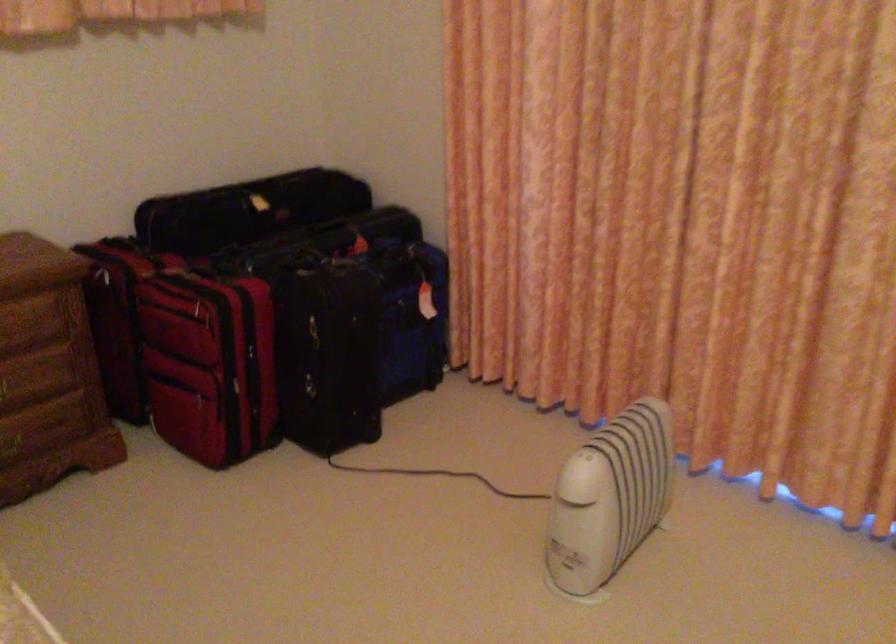
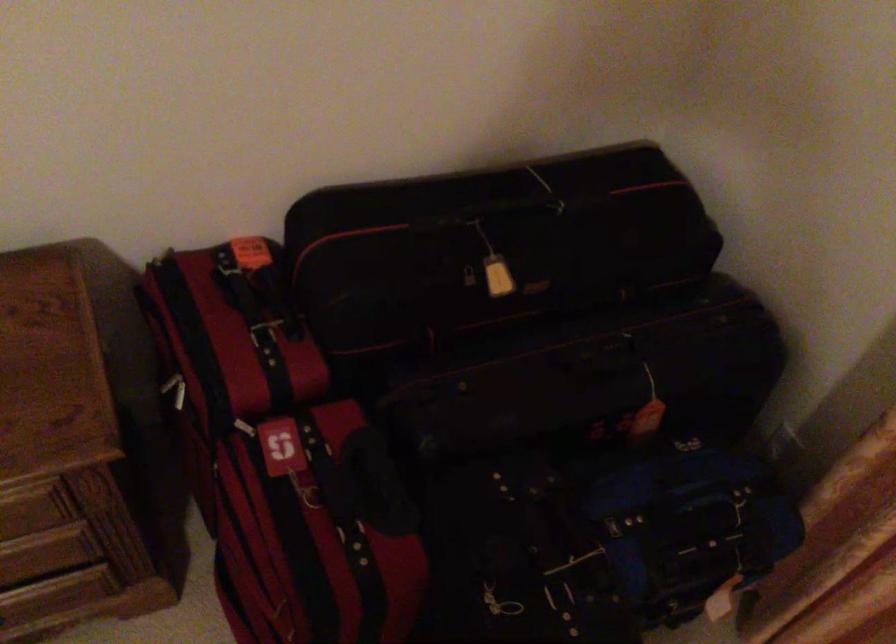
Locate, in the second image, the point that corresponds to the point at 250,210 in the first image.

(470, 287)